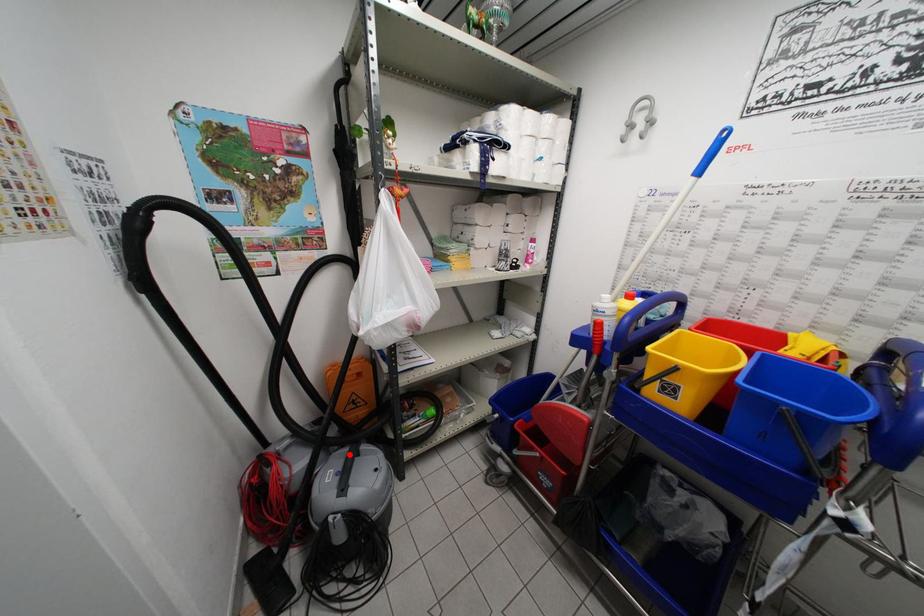
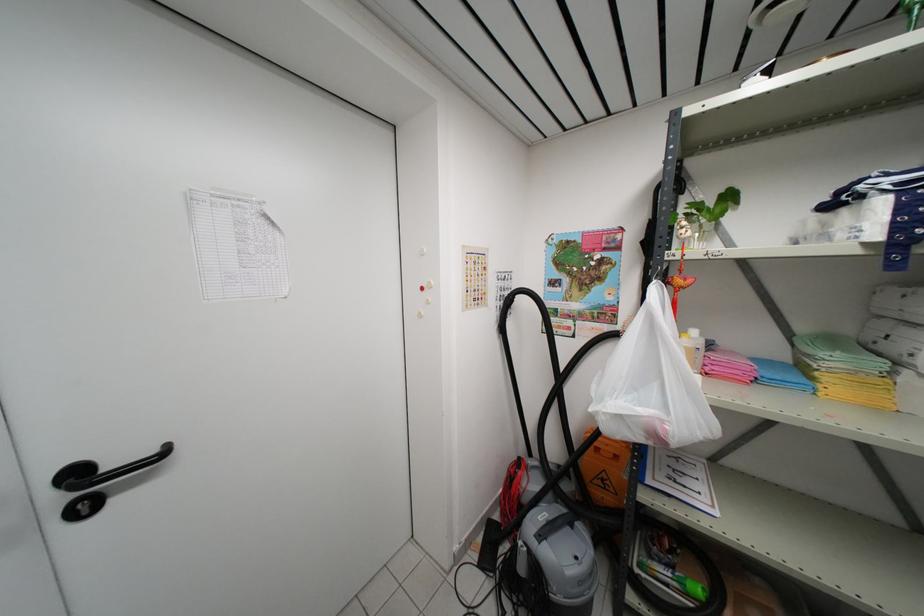
Question: I am providing you with two images of the same scene from different viewpoints. In image1, a red point is highlighted. Considering the same 3D point in image2, which of the following is correct?

Choices:
 (A) It is closer
 (B) It is farther

Answer: (B)